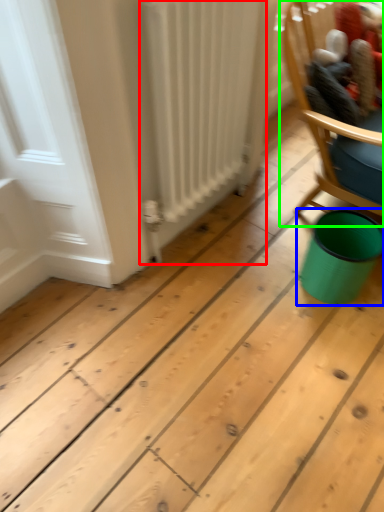
Question: Which object is the farthest from radiator (highlighted by a red box)? Choose among these: teal (highlighted by a blue box) or chair (highlighted by a green box).

Choices:
 (A) teal
 (B) chair

Answer: (A)